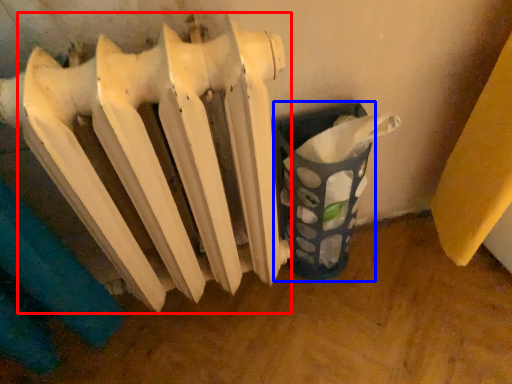
Question: Which of the following is the closest to the observer, radiator (highlighted by a red box) or waste container (highlighted by a blue box)?

Choices:
 (A) radiator
 (B) waste container

Answer: (A)